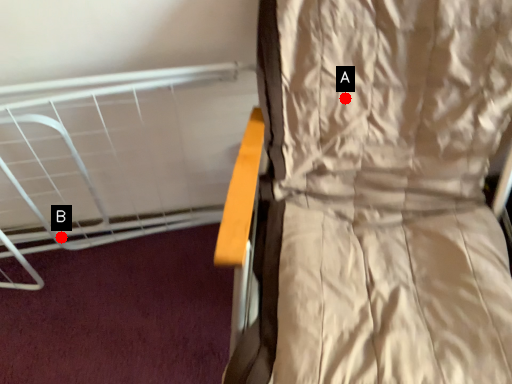
Question: Two points are circled on the image, labeled by A and B beside each circle. Which point is closer to the camera?

Choices:
 (A) A is closer
 (B) B is closer

Answer: (A)